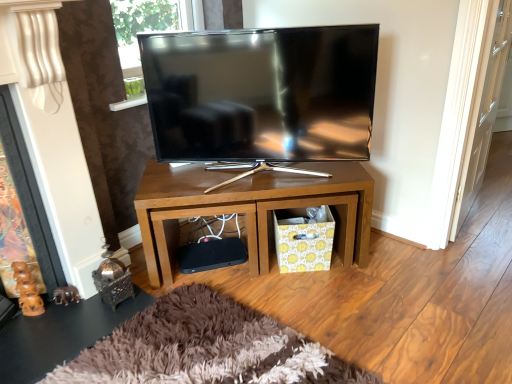
Find the location of a particular element. The width and height of the screenshot is (512, 384). free location in front of yellow floral cardboard crate at lower center is located at coordinates (307, 293).